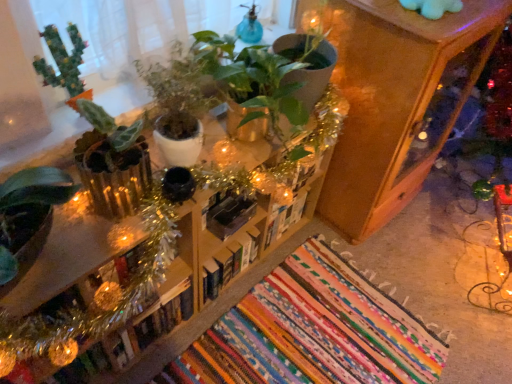
Find the location of a particular element. vacant space in front of hardcover book at center, which is the third book in right-to-left order is located at coordinates (224, 316).